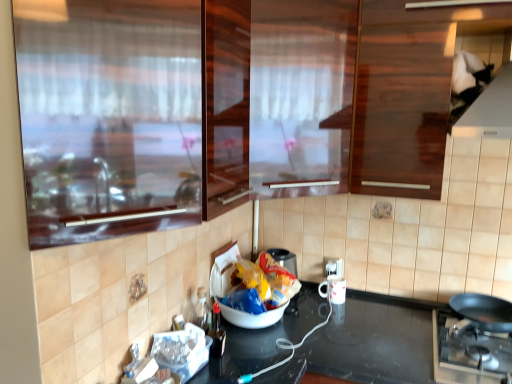
Find the location of `yellow plastic bag at center`. yellow plastic bag at center is located at coordinates (268, 279).

Describe the element at coordinates (108, 116) in the screenshot. I see `transparent glass door at upper left, positioned as the 1th glass door in front-to-back order` at that location.

Image resolution: width=512 pixels, height=384 pixels. What do you see at coordinates (230, 105) in the screenshot?
I see `brown glossy cabinet at upper center` at bounding box center [230, 105].

The image size is (512, 384). I want to click on white plastic electric outlet at lower right, so click(x=332, y=266).

What is the approximate width of black matte pan at lower right?

The width of black matte pan at lower right is 23.45 inches.

What do you see at coordinates (333, 281) in the screenshot? Image resolution: width=512 pixels, height=384 pixels. I see `white glossy mug at lower center` at bounding box center [333, 281].

What do you see at coordinates (301, 96) in the screenshot?
I see `transparent glossy glass door at upper center, the 1th glass door positioned from the back` at bounding box center [301, 96].

The image size is (512, 384). I want to click on yellow plastic bag at center, so click(x=268, y=279).

Between black glossy countertop at center and transparent glossy glass door at upper center, positioned as the second glass door in front-to-back order, which one appears on the right side from the viewer's perspective?

Positioned to the right is black glossy countertop at center.

How many degrees apart are the facing directions of black glossy countertop at center and transparent glossy glass door at upper center, the 1th glass door positioned from the back?

The angle between the facing direction of black glossy countertop at center and the facing direction of transparent glossy glass door at upper center, the 1th glass door positioned from the back, is 44.9 degrees.

Locate an element on the screen. The image size is (512, 384). countertop located below the transparent glossy glass door at upper center, the 1th glass door positioned from the back (from the image's perspective) is located at coordinates (373, 341).

Which object is further away from the camera taking this photo, black glossy countertop at center or transparent glossy glass door at upper center, positioned as the second glass door in front-to-back order?

black glossy countertop at center is further from the camera.

From the picture: From the image's perspective, is black matte pan at lower right over white plastic electric outlet at lower right?

No, from the image's perspective, black matte pan at lower right is not above white plastic electric outlet at lower right.

Who is smaller, black matte pan at lower right or white plastic electric outlet at lower right?

white plastic electric outlet at lower right.

Is black matte pan at lower right next to white plastic electric outlet at lower right and touching it?

No, black matte pan at lower right is not making contact with white plastic electric outlet at lower right.

Is white plastic electric outlet at lower right facing towards brown glossy cabinet at upper center?

No.

From a real-world perspective, is white plastic electric outlet at lower right above or below brown glossy cabinet at upper center?

white plastic electric outlet at lower right is situated lower than brown glossy cabinet at upper center in the real world.

Is white plastic electric outlet at lower right outside of brown glossy cabinet at upper center?

Yes.

Which object is further away from the camera taking this photo, white plastic electric outlet at lower right or brown glossy cabinet at upper center?

white plastic electric outlet at lower right is more distant.

Considering the positions of objects white plastic electric outlet at lower right and white glossy mug at lower center in the image provided, who is in front, white plastic electric outlet at lower right or white glossy mug at lower center?

white glossy mug at lower center is closer to the camera.

Can you tell me how much white plastic electric outlet at lower right and white glossy mug at lower center differ in facing direction?

The angle between the facing direction of white plastic electric outlet at lower right and the facing direction of white glossy mug at lower center is 5.85 degrees.

Measure the distance between white plastic electric outlet at lower right and white glossy mug at lower center.

white plastic electric outlet at lower right and white glossy mug at lower center are 1.13 inches apart from each other.

Based on their positions, is white plastic electric outlet at lower right located to the left or right of white glossy mug at lower center?

From the image, it's evident that white plastic electric outlet at lower right is to the right of white glossy mug at lower center.

From the image's perspective, would you say black matte pan at lower right is positioned over white glossy mug at lower center?

No.

From a real-world perspective, which is physically above, black matte pan at lower right or white glossy mug at lower center?

white glossy mug at lower center, from a real-world perspective.

Can you confirm if black matte pan at lower right is positioned to the left of white glossy mug at lower center?

No, black matte pan at lower right is not to the left of white glossy mug at lower center.

Relative to white glossy mug at lower center, is black matte pan at lower right in front or behind?

Clearly, black matte pan at lower right is in front of white glossy mug at lower center.

Is black matte pan at lower right placed right next to black glossy countertop at center?

No, black matte pan at lower right is not next to black glossy countertop at center.

Is black matte pan at lower right positioned beyond the bounds of black glossy countertop at center?

Yes, black matte pan at lower right is not within black glossy countertop at center.

Which object is more forward, black matte pan at lower right or black glossy countertop at center?

black matte pan at lower right is more forward.

Who is smaller, black matte pan at lower right or black glossy countertop at center?

black matte pan at lower right is smaller.

From a real-world perspective, is white glossy mug at lower center physically below black glossy countertop at center?

No, from a real-world perspective, white glossy mug at lower center is not below black glossy countertop at center.

Can you tell me how much white glossy mug at lower center and black glossy countertop at center differ in facing direction?

5.25 degrees.

Considering the relative positions of white glossy mug at lower center and black glossy countertop at center in the image provided, is white glossy mug at lower center in front of black glossy countertop at center?

No, white glossy mug at lower center is behind black glossy countertop at center.

Consider the image. Are white glossy mug at lower center and black glossy countertop at center far apart?

No.

Starting from the black glossy countertop at center, which glass door is the 1st one to the left? Please provide its 2D coordinates.

[(301, 96)]

Locate an element on the screen. Image resolution: width=512 pixels, height=384 pixels. electric outlet above the black matte pan at lower right (from the image's perspective) is located at coordinates (332, 266).

Estimate the real-world distances between objects in this image. Which object is closer to transparent glossy glass door at upper center, positioned as the second glass door in front-to-back order, yellow plastic bag at center or transparent glass door at upper left, positioned as the 1th glass door in front-to-back order?

Among the two, transparent glass door at upper left, positioned as the 1th glass door in front-to-back order, is located nearer to transparent glossy glass door at upper center, positioned as the second glass door in front-to-back order.

Based on their spatial positions, is brown glossy cabinet at upper center or black glossy countertop at center further from white plastic electric outlet at lower right?

brown glossy cabinet at upper center.

Estimate the real-world distances between objects in this image. Which object is further from white plastic electric outlet at lower right, brown glossy cabinet at upper center or transparent glossy glass door at upper center, the 1th glass door positioned from the back?

Among the two, brown glossy cabinet at upper center is located further to white plastic electric outlet at lower right.

From the image, which object appears to be farther from yellow plastic bag at center, white glossy mug at lower center or transparent glass door at upper left, which ranks as the second glass door in back-to-front order?

transparent glass door at upper left, which ranks as the second glass door in back-to-front order, is further to yellow plastic bag at center.

Which object lies nearer to the anchor point brown glossy cabinet at upper center, black matte pan at lower right or white glossy mug at lower center?

black matte pan at lower right lies closer to brown glossy cabinet at upper center than the other object.

From the picture: Which object lies further to the anchor point white plastic electric outlet at lower right, yellow plastic bag at center or black matte pan at lower right?

black matte pan at lower right is further to white plastic electric outlet at lower right.

From the image, which object appears to be nearer to black matte pan at lower right, transparent glass door at upper left, positioned as the 1th glass door in front-to-back order, or transparent glossy glass door at upper center, the 1th glass door positioned from the back?

transparent glossy glass door at upper center, the 1th glass door positioned from the back, is closer to black matte pan at lower right.

Considering their positions, is yellow plastic bag at center positioned further to black matte pan at lower right than white plastic electric outlet at lower right?

white plastic electric outlet at lower right is positioned further to the anchor black matte pan at lower right.

Locate an element on the screen. This screenshot has width=512, height=384. countertop between brown glossy cabinet at upper center and white plastic electric outlet at lower right in the front-back direction is located at coordinates (373, 341).

Identify the location of electric outlet between transparent glossy glass door at upper center, positioned as the second glass door in front-to-back order, and white glossy mug at lower center vertically. The height and width of the screenshot is (384, 512). (332, 266).

Find the location of a particular element. This screenshot has width=512, height=384. glass door located between transparent glass door at upper left, which ranks as the second glass door in back-to-front order, and white plastic electric outlet at lower right in the depth direction is located at coordinates (301, 96).

Locate an element on the screen. The height and width of the screenshot is (384, 512). garbage located between brown glossy cabinet at upper center and white plastic electric outlet at lower right in the depth direction is located at coordinates (268, 279).